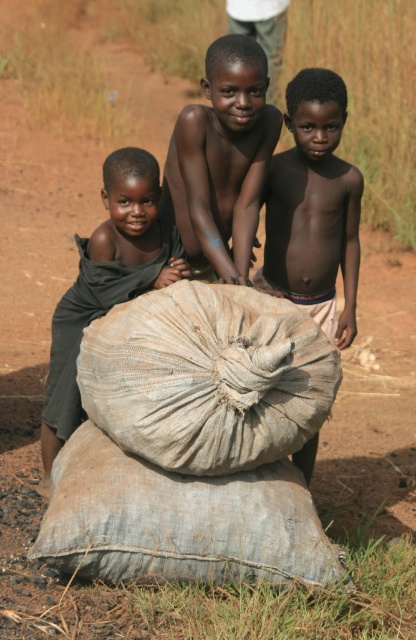
Question: Among these points, which one is nearest to the camera?

Choices:
 (A) (193, 195)
 (B) (146, 234)
 (C) (316, 442)

Answer: (A)

Question: Where is smooth skin boy at center located in relation to brown matte boy at center in the image?

Choices:
 (A) above
 (B) below

Answer: (B)

Question: Which of the following is the farthest from the observer?

Choices:
 (A) pyautogui.click(x=54, y=339)
 (B) pyautogui.click(x=327, y=154)
 (C) pyautogui.click(x=257, y=154)

Answer: (B)

Question: Which of the following is the farthest from the observer?

Choices:
 (A) dark green fabric at left
 (B) brown matte boy at center

Answer: (A)

Question: Can you confirm if smooth skin boy at center is positioned below brown matte boy at center?

Choices:
 (A) yes
 (B) no

Answer: (A)

Question: Is smooth skin boy at center behind brown matte boy at center?

Choices:
 (A) no
 (B) yes

Answer: (B)